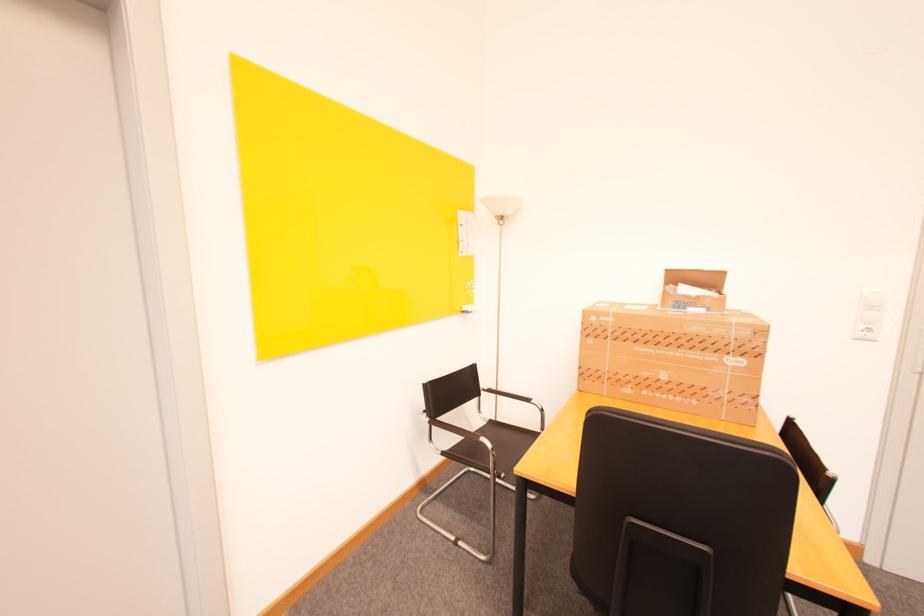
Where would you open the large cardboard box? Please return your answer as a coordinate pair (x, y).

(676, 350)